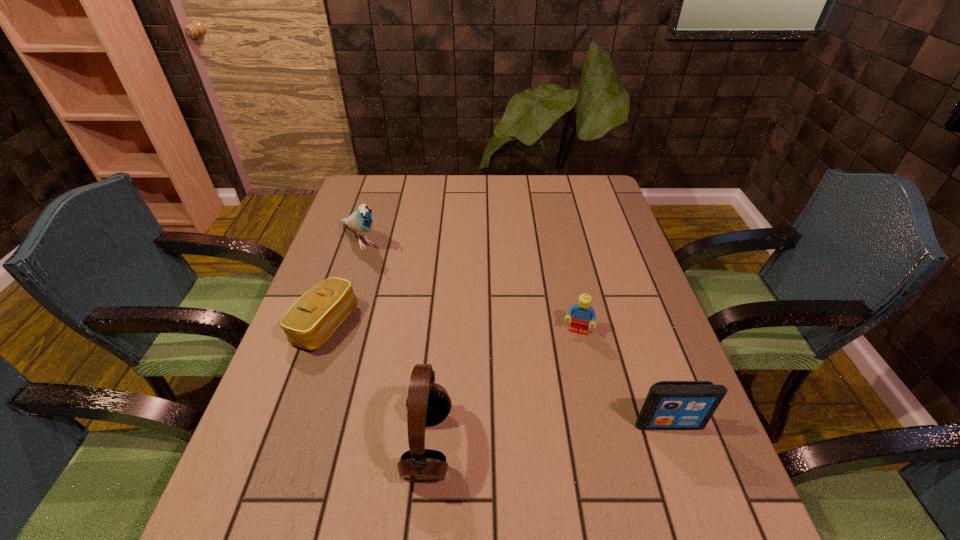
You are a GUI agent. You are given a task and a screenshot of the screen. Output one action in this format:
    pyautogui.click(x=<x>, y=<y>)
    Task: Click on the vacant space that satisfies the following two spatial constraints: 1. on the front side of the shortest object; 2. on the left side of the second object from right to left
    
    Given the screenshot: What is the action you would take?
    pyautogui.click(x=323, y=332)